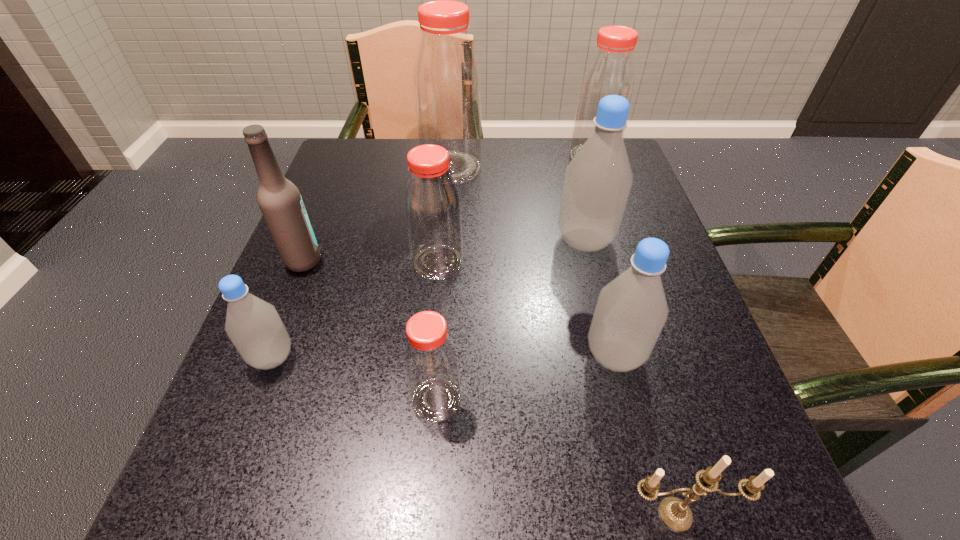
The image size is (960, 540). I want to click on free region located on the back of the candle, so click(635, 369).

Identify the location of object at the near edge. (675, 513).

At what (x,y) coordinates should I click in order to perform the action: click on beer bottle located at the left edge. Please return your answer as a coordinate pair (x, y). This screenshot has width=960, height=540. Looking at the image, I should click on (280, 201).

Identify the location of bottle at the left edge. This screenshot has height=540, width=960. 254,326.

Find the location of a particular element. The image size is (960, 540). candle positioned at the right edge is located at coordinates (675, 513).

The height and width of the screenshot is (540, 960). Identify the location of object at the far right corner. (611, 71).

I want to click on object that is at the near right corner, so click(675, 513).

You are a GUI agent. You are given a task and a screenshot of the screen. Output one action in this format:
    pyautogui.click(x=<x>, y=<y>)
    Task: Click on the free space at the far edge of the desktop
    The image size is (960, 540).
    Given the screenshot: What is the action you would take?
    pyautogui.click(x=521, y=179)

At what (x,y) coordinates should I click in order to perform the action: click on blank area at the near edge. Please return your answer as a coordinate pair (x, y). The height and width of the screenshot is (540, 960). Looking at the image, I should click on (501, 510).

Find the location of a particular element. This screenshot has height=540, width=960. free space at the left edge is located at coordinates (299, 406).